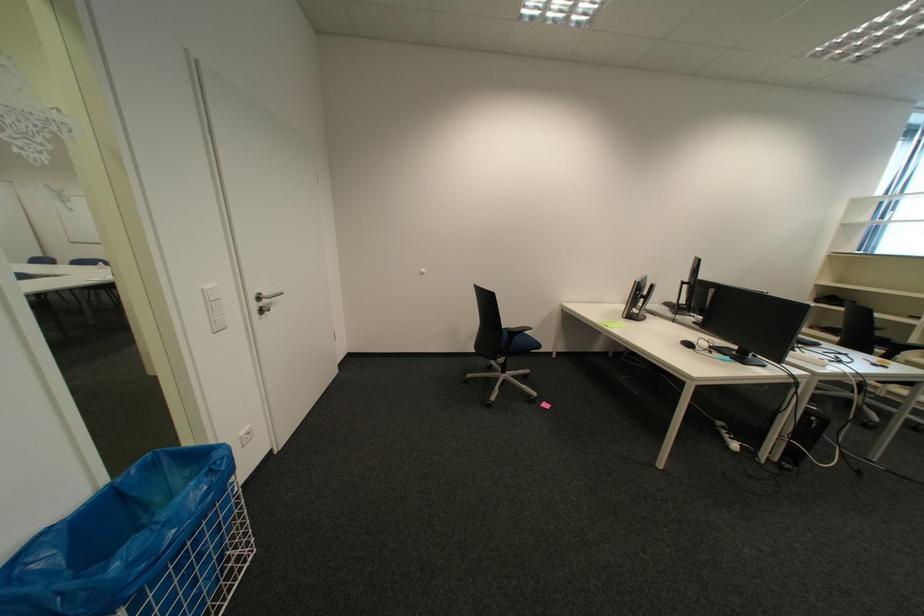
Identify the location of chair armrest. The image size is (924, 616). (516, 329).